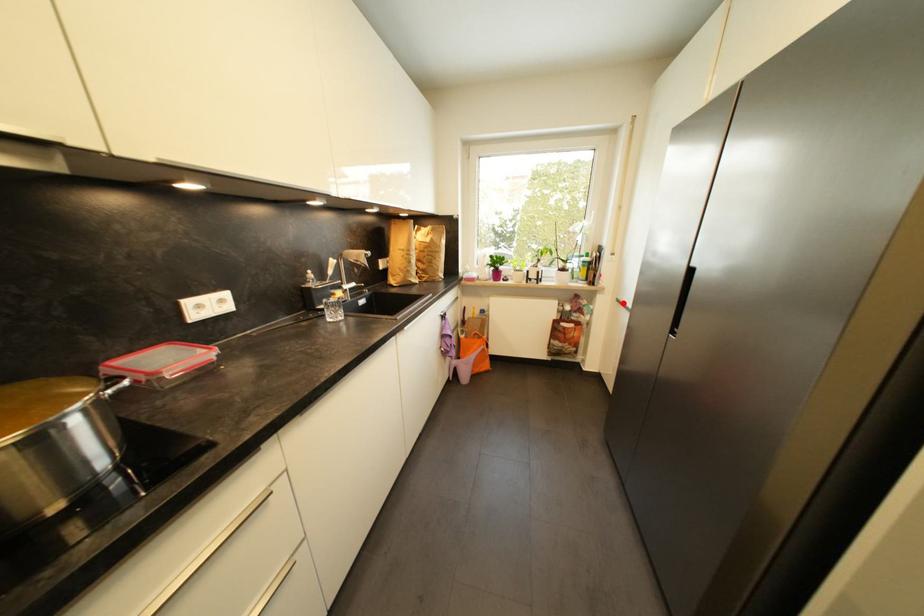
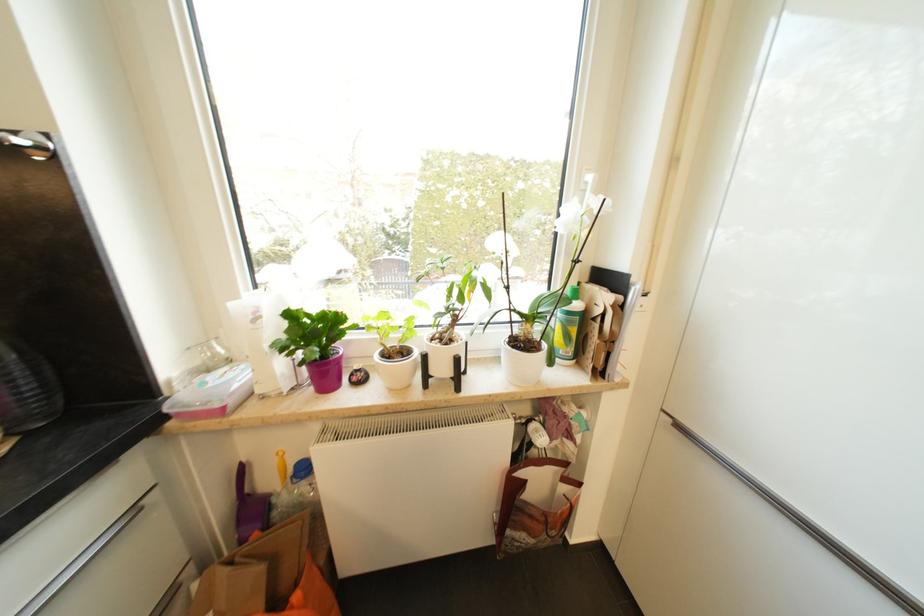
Locate, in the second image, the point that corresponds to the highlighted location in the first image.

(685, 429)